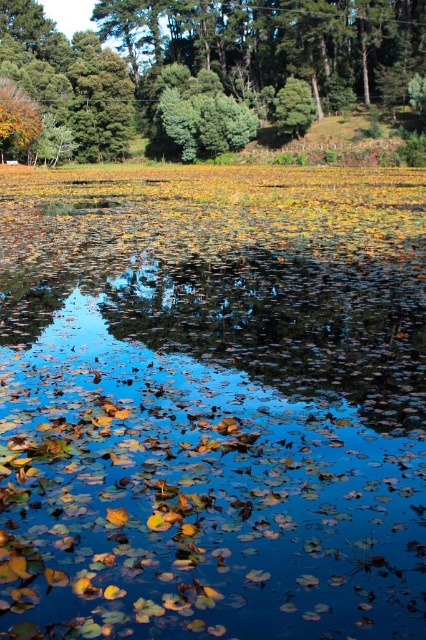
Question: Which point is closer to the camera taking this photo?

Choices:
 (A) (149, 353)
 (B) (262, 122)

Answer: (A)

Question: Can you confirm if yellow-green leaves at center is positioned to the left of green matte tree at upper left?

Choices:
 (A) no
 (B) yes

Answer: (A)

Question: Among these points, which one is nearest to the camera?

Choices:
 (A) (385, 442)
 (B) (339, 28)

Answer: (A)

Question: Observing the image, what is the correct spatial positioning of yellow-green leaves at center in reference to green matte tree at upper left?

Choices:
 (A) left
 (B) right

Answer: (B)

Question: Is yellow-green leaves at center further to camera compared to green matte tree at upper left?

Choices:
 (A) yes
 (B) no

Answer: (B)